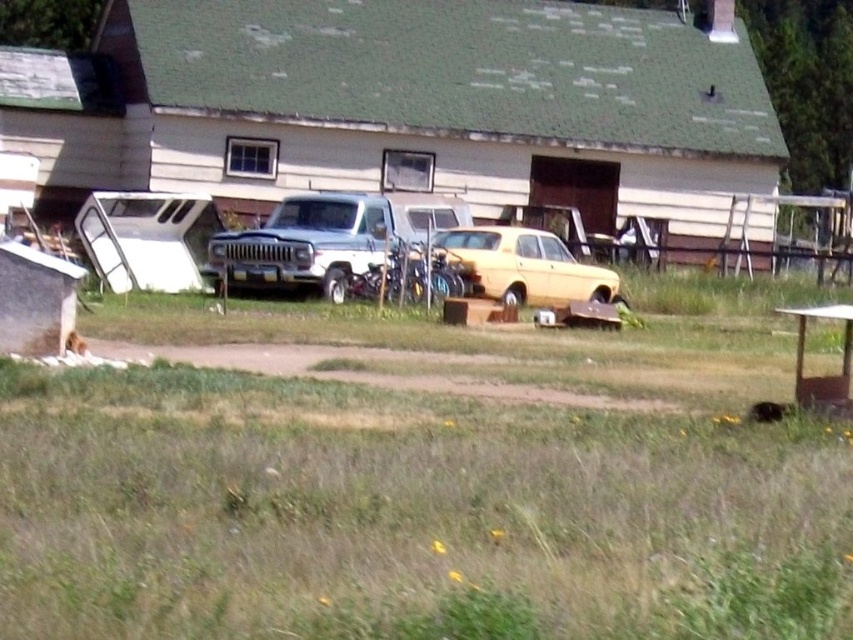
You are standing at the front of the building and want to walk to the point marked by point (491, 157). Will you have to walk past point (521, 300) first?

Yes, because point (491, 157) is behind point (521, 300) from your current position at the front of the building.

You are standing at the point labeled point (405, 106) in the image. What is the object located exactly at this point?

The point (405, 106) indicates the green shingled shed at center.

You are standing in front of the rural building and want to place a new sign on the wall between the green shingled shed at center and the white matte truck at center. Which object should the sign be placed closer to so it is visible from the road?

The green shingled shed at center is above the white matte truck at center, so placing the sign closer to the shed would make it more visible from the road since it is higher up.